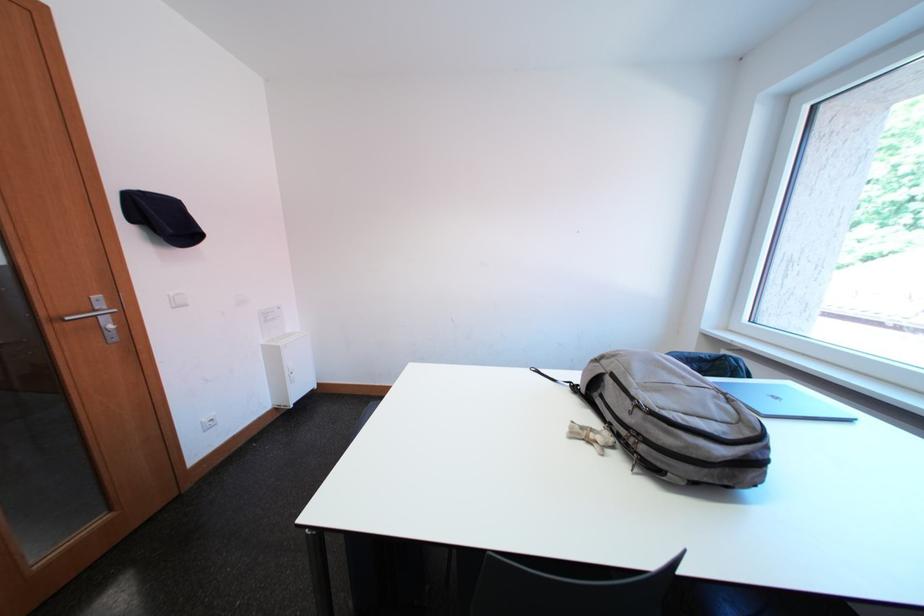
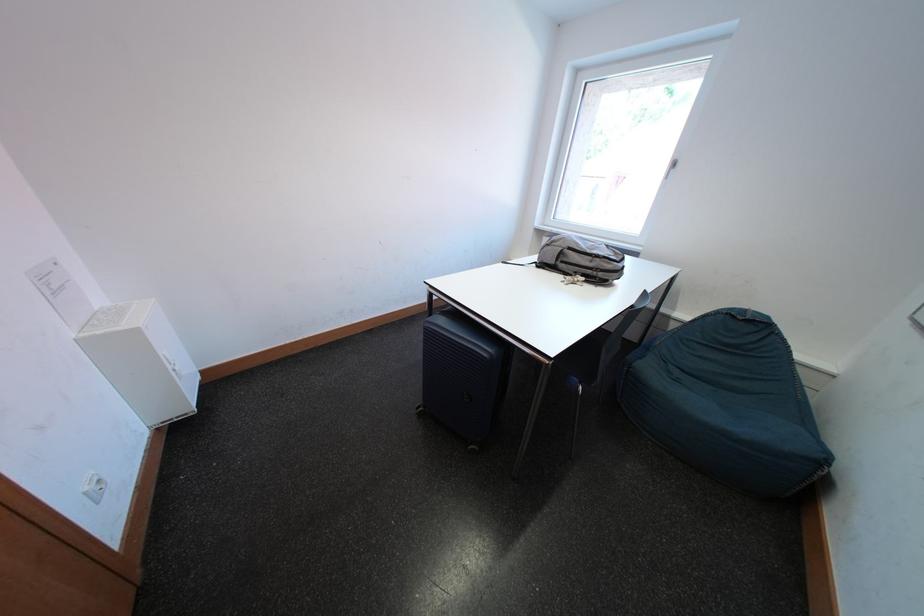
Find the pixel in the second image that matches pixel 640 416 in the first image.

(601, 265)